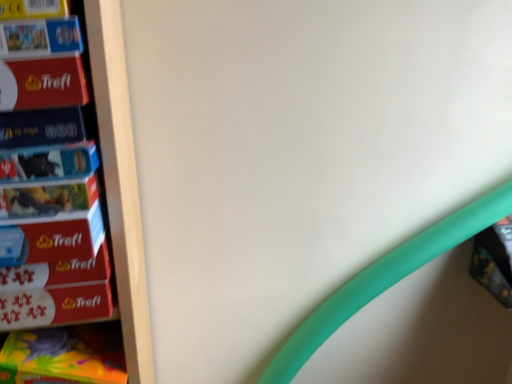
Where is `matte cardboard book at left, the second paperback book in the bottom-to-top sequence`? The image size is (512, 384). matte cardboard book at left, the second paperback book in the bottom-to-top sequence is located at coordinates (41, 127).

At what (x,y) coordinates should I click in order to perform the action: click on matte cardboard book at left, the second paperback book in the bottom-to-top sequence. Please return your answer as a coordinate pair (x, y). Looking at the image, I should click on (41, 127).

From the image's perspective, is matte cardboard book at left, the second paperback book positioned from the top, below matte black book at left, which is the 1th paperback book in bottom-to-top order?

No, from the image's perspective, matte cardboard book at left, the second paperback book positioned from the top, is not below matte black book at left, which is the 1th paperback book in bottom-to-top order.

Is matte cardboard book at left, the second paperback book positioned from the top, facing towards matte black book at left, placed as the third paperback book when sorted from top to bottom?

No, matte cardboard book at left, the second paperback book positioned from the top, is not facing towards matte black book at left, placed as the third paperback book when sorted from top to bottom.

Is matte cardboard book at left, the second paperback book in the bottom-to-top sequence, at the left side of matte black book at left, placed as the third paperback book when sorted from top to bottom?

Yes.

Considering the points (50, 109) and (2, 168), which point is behind, point (50, 109) or point (2, 168)?

Positioned behind is point (50, 109).

Which object is thinner, matte cardboard book at upper left, which is the second book in right-to-left order, or matte cardboard book at left, the second paperback book positioned from the top?

matte cardboard book at left, the second paperback book positioned from the top.

In the image, is matte cardboard book at upper left, the 1th book in the left-to-right sequence, on the left side or the right side of matte cardboard book at left, the second paperback book positioned from the top?

matte cardboard book at upper left, the 1th book in the left-to-right sequence, is to the left of matte cardboard book at left, the second paperback book positioned from the top.

In the scene shown: From a real-world perspective, is matte cardboard book at upper left, the 1th book in the left-to-right sequence, physically located above or below matte cardboard book at left, the second paperback book in the bottom-to-top sequence?

In terms of real-world spatial position, matte cardboard book at upper left, the 1th book in the left-to-right sequence, is above matte cardboard book at left, the second paperback book in the bottom-to-top sequence.

Are matte cardboard book at left, the second paperback book positioned from the top, and matte red puzzle box at left, the 1th paperback book from the top, making contact?

Yes, matte cardboard book at left, the second paperback book positioned from the top, is in contact with matte red puzzle box at left, the 1th paperback book from the top.

From a real-world perspective, is matte cardboard book at left, the second paperback book positioned from the top, physically located above or below matte red puzzle box at left, positioned as the third paperback book in bottom-to-top order?

matte cardboard book at left, the second paperback book positioned from the top, is situated lower than matte red puzzle box at left, positioned as the third paperback book in bottom-to-top order, in the real world.

Considering the positions of objects matte cardboard book at left, the second paperback book positioned from the top, and matte red puzzle box at left, positioned as the third paperback book in bottom-to-top order, in the image provided, who is more to the left, matte cardboard book at left, the second paperback book positioned from the top, or matte red puzzle box at left, positioned as the third paperback book in bottom-to-top order,?

Positioned to the left is matte red puzzle box at left, positioned as the third paperback book in bottom-to-top order.

Is matte cardboard book at left, the second paperback book in the bottom-to-top sequence, positioned with its back to matte red puzzle box at left, the 1th paperback book from the top?

No, matte cardboard book at left, the second paperback book in the bottom-to-top sequence,'s orientation is not away from matte red puzzle box at left, the 1th paperback book from the top.

From the picture: Considering the sizes of objects matte plastic book at right, which is the second book in left-to-right order, and matte black book at left, placed as the third paperback book when sorted from top to bottom, in the image provided, who is wider, matte plastic book at right, which is the second book in left-to-right order, or matte black book at left, placed as the third paperback book when sorted from top to bottom,?

matte black book at left, placed as the third paperback book when sorted from top to bottom, is wider.

Considering the points (502, 223) and (93, 164), which point is in front, point (502, 223) or point (93, 164)?

Positioned in front is point (93, 164).

Looking at this image, can you confirm if matte plastic book at right, which is the 1th book in bottom-to-top order, is positioned to the left of matte black book at left, which is the 1th paperback book in bottom-to-top order?

No.

Is the position of matte plastic book at right, which is the second book in left-to-right order, less distant than that of matte black book at left, which is the 1th paperback book in bottom-to-top order?

That is False.

Which of these two, matte cardboard book at upper left, which is counted as the 2th book, starting from the back, or matte red puzzle box at left, the 1th paperback book from the top, is wider?

With larger width is matte red puzzle box at left, the 1th paperback book from the top.

Considering the relative sizes of matte cardboard book at upper left, which is the second book in right-to-left order, and matte red puzzle box at left, positioned as the third paperback book in bottom-to-top order, in the image provided, is matte cardboard book at upper left, which is the second book in right-to-left order, bigger than matte red puzzle box at left, positioned as the third paperback book in bottom-to-top order,?

No, matte cardboard book at upper left, which is the second book in right-to-left order, is not bigger than matte red puzzle box at left, positioned as the third paperback book in bottom-to-top order.

From a real-world perspective, is matte cardboard book at upper left, the 2th book from the bottom, above or below matte red puzzle box at left, positioned as the third paperback book in bottom-to-top order?

In terms of real-world spatial position, matte cardboard book at upper left, the 2th book from the bottom, is above matte red puzzle box at left, positioned as the third paperback book in bottom-to-top order.

Considering the sizes of matte cardboard book at upper left, the 1th book viewed from the top, and matte red puzzle box at left, positioned as the third paperback book in bottom-to-top order, in the image, is matte cardboard book at upper left, the 1th book viewed from the top, taller or shorter than matte red puzzle box at left, positioned as the third paperback book in bottom-to-top order,?

In the image, matte cardboard book at upper left, the 1th book viewed from the top, appears to be shorter than matte red puzzle box at left, positioned as the third paperback book in bottom-to-top order.

Is matte cardboard book at upper left, which ranks as the first book in front-to-back order, located within matte black book at left, which is the 1th paperback book in bottom-to-top order?

No, matte cardboard book at upper left, which ranks as the first book in front-to-back order, is not inside matte black book at left, which is the 1th paperback book in bottom-to-top order.

Between matte black book at left, placed as the third paperback book when sorted from top to bottom, and matte cardboard book at upper left, which is counted as the 2th book, starting from the back, which one has more height?

matte cardboard book at upper left, which is counted as the 2th book, starting from the back, is taller.

Consider the image. Considering the positions of objects matte black book at left, which is the 1th paperback book in bottom-to-top order, and matte cardboard book at upper left, the 2th book from the bottom, in the image provided, who is behind, matte black book at left, which is the 1th paperback book in bottom-to-top order, or matte cardboard book at upper left, the 2th book from the bottom,?

matte black book at left, which is the 1th paperback book in bottom-to-top order, is behind.

Is matte black book at left, which is the 1th paperback book in bottom-to-top order, at the left side of matte cardboard book at upper left, the 1th book viewed from the top?

No.

Considering the sizes of objects matte plastic book at right, which is the second book in left-to-right order, and matte red puzzle box at left, positioned as the third paperback book in bottom-to-top order, in the image provided, who is smaller, matte plastic book at right, which is the second book in left-to-right order, or matte red puzzle box at left, positioned as the third paperback book in bottom-to-top order,?

Smaller between the two is matte red puzzle box at left, positioned as the third paperback book in bottom-to-top order.

Measure the distance between matte plastic book at right, marked as the 2th book in a top-to-bottom arrangement, and matte red puzzle box at left, the 1th paperback book from the top.

They are 1.00 meters apart.

How many degrees apart are the facing directions of matte plastic book at right, the second book in the front-to-back sequence, and matte red puzzle box at left, the 1th paperback book from the top?

There is a 96.5-degree angle between the facing directions of matte plastic book at right, the second book in the front-to-back sequence, and matte red puzzle box at left, the 1th paperback book from the top.

Looking at this image, is matte plastic book at right, which is the second book in left-to-right order, situated inside matte red puzzle box at left, the 1th paperback book from the top, or outside?

matte plastic book at right, which is the second book in left-to-right order, is located beyond the bounds of matte red puzzle box at left, the 1th paperback book from the top.

Where is `the 1st paperback book to the left of the matte black book at left, placed as the third paperback book when sorted from top to bottom, counting from the anchor's position`? The height and width of the screenshot is (384, 512). the 1st paperback book to the left of the matte black book at left, placed as the third paperback book when sorted from top to bottom, counting from the anchor's position is located at coordinates (41, 127).

You are a GUI agent. You are given a task and a screenshot of the screen. Output one action in this format:
    pyautogui.click(x=<x>, y=<y>)
    Task: Click on the 2nd paperback book below the matte cardboard book at upper left, which is the second book in right-to-left order (from the image's perspective)
    The height and width of the screenshot is (384, 512).
    Given the screenshot: What is the action you would take?
    pyautogui.click(x=41, y=127)

Based on the photo, when comparing their distances from matte red puzzle box at left, positioned as the third paperback book in bottom-to-top order, does matte plastic book at right, which is the second book in left-to-right order, or matte cardboard book at upper left, which is the second book in right-to-left order, seem further?

Based on the image, matte plastic book at right, which is the second book in left-to-right order, appears to be further to matte red puzzle box at left, positioned as the third paperback book in bottom-to-top order.

Which object lies nearer to the anchor point matte cardboard book at left, the second paperback book in the bottom-to-top sequence, matte plastic book at right, the second book in the front-to-back sequence, or matte black book at left, placed as the third paperback book when sorted from top to bottom?

matte black book at left, placed as the third paperback book when sorted from top to bottom, lies closer to matte cardboard book at left, the second paperback book in the bottom-to-top sequence, than the other object.

From the image, which object appears to be nearer to matte cardboard book at upper left, the 1th book viewed from the top, matte black book at left, which is the 1th paperback book in bottom-to-top order, or matte cardboard book at left, the second paperback book positioned from the top?

Based on the image, matte cardboard book at left, the second paperback book positioned from the top, appears to be nearer to matte cardboard book at upper left, the 1th book viewed from the top.

Which object lies further to the anchor point matte cardboard book at left, the second paperback book positioned from the top, matte black book at left, which is the 1th paperback book in bottom-to-top order, or matte plastic book at right, the 1th book viewed from the right?

matte plastic book at right, the 1th book viewed from the right, lies further to matte cardboard book at left, the second paperback book positioned from the top, than the other object.

Which object lies further to the anchor point matte red puzzle box at left, positioned as the third paperback book in bottom-to-top order, matte black book at left, which is the 1th paperback book in bottom-to-top order, or matte cardboard book at left, the second paperback book positioned from the top?

The object further to matte red puzzle box at left, positioned as the third paperback book in bottom-to-top order, is matte black book at left, which is the 1th paperback book in bottom-to-top order.

Looking at the image, which one is located further to matte cardboard book at left, the second paperback book positioned from the top, matte red puzzle box at left, the 1th paperback book from the top, or matte cardboard book at upper left, which is the second book in right-to-left order?

matte cardboard book at upper left, which is the second book in right-to-left order, is further to matte cardboard book at left, the second paperback book positioned from the top.

Estimate the real-world distances between objects in this image. Which object is further from matte black book at left, placed as the third paperback book when sorted from top to bottom, matte cardboard book at upper left, which ranks as the first book in front-to-back order, or matte plastic book at right, which is the 1th book in bottom-to-top order?

matte plastic book at right, which is the 1th book in bottom-to-top order.

Estimate the real-world distances between objects in this image. Which object is closer to matte black book at left, which is the 1th paperback book in bottom-to-top order, matte cardboard book at left, the second paperback book in the bottom-to-top sequence, or matte cardboard book at upper left, which is counted as the 2th book, starting from the back?

Among the two, matte cardboard book at left, the second paperback book in the bottom-to-top sequence, is located nearer to matte black book at left, which is the 1th paperback book in bottom-to-top order.

You are a GUI agent. You are given a task and a screenshot of the screen. Output one action in this format:
    pyautogui.click(x=<x>, y=<y>)
    Task: Click on the paperback book between matte red puzzle box at left, positioned as the third paperback book in bottom-to-top order, and matte black book at left, which is the 1th paperback book in bottom-to-top order, from top to bottom
    This screenshot has width=512, height=384.
    Given the screenshot: What is the action you would take?
    pyautogui.click(x=41, y=127)

Where is `paperback book between matte cardboard book at upper left, the 2th book from the bottom, and matte cardboard book at left, the second paperback book positioned from the top, from top to bottom`? The height and width of the screenshot is (384, 512). paperback book between matte cardboard book at upper left, the 2th book from the bottom, and matte cardboard book at left, the second paperback book positioned from the top, from top to bottom is located at coordinates click(x=42, y=83).

At what (x,y) coordinates should I click in order to perform the action: click on book between matte red puzzle box at left, positioned as the third paperback book in bottom-to-top order, and matte plastic book at right, marked as the 2th book in a top-to-bottom arrangement, from left to right. Please return your answer as a coordinate pair (x, y). The width and height of the screenshot is (512, 384). Looking at the image, I should click on (40, 37).

Where is `paperback book between matte cardboard book at left, the second paperback book positioned from the top, and matte plastic book at right, the 1th book viewed from the right, in the horizontal direction`? The height and width of the screenshot is (384, 512). paperback book between matte cardboard book at left, the second paperback book positioned from the top, and matte plastic book at right, the 1th book viewed from the right, in the horizontal direction is located at coordinates (48, 161).